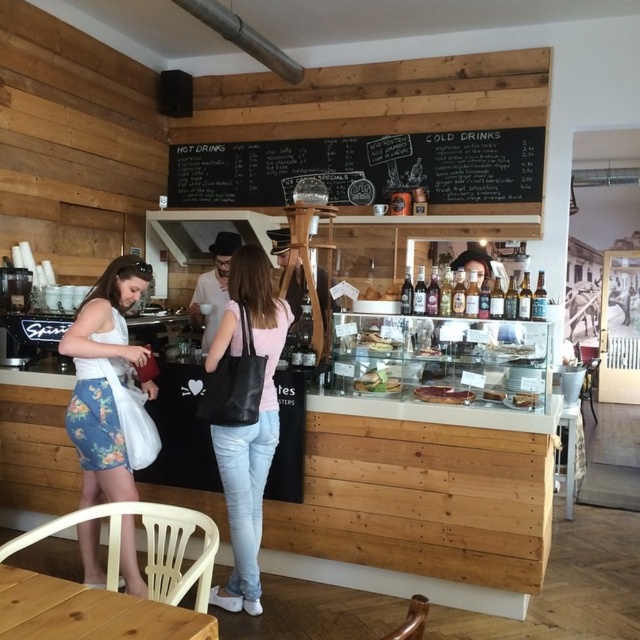
Question: Does matte white cake at center appear under chocolate cake at center?

Choices:
 (A) no
 (B) yes

Answer: (A)

Question: Which of these objects is positioned closest to the floral denim skirt at lower left?

Choices:
 (A) matte glass cake at center
 (B) matte white cake at center
 (C) chocolate cake at center
 (D) green leafy salad at center

Answer: (D)

Question: Which object is positioned closest to the smooth white cake at center?

Choices:
 (A) black chalkboard at upper center
 (B) matte white cake at center
 (C) matte brown pastry at center

Answer: (C)

Question: Can you confirm if matte brown pastry at center is bigger than chocolate cake at center?

Choices:
 (A) yes
 (B) no

Answer: (A)

Question: Which object appears closest to the camera in this image?

Choices:
 (A) floral denim skirt at lower left
 (B) green leafy salad at center
 (C) matte brown pastry at center
 (D) black chalkboard at upper center

Answer: (A)

Question: Is matte black tote bag at center positioned in front of green leafy salad at center?

Choices:
 (A) no
 (B) yes

Answer: (B)